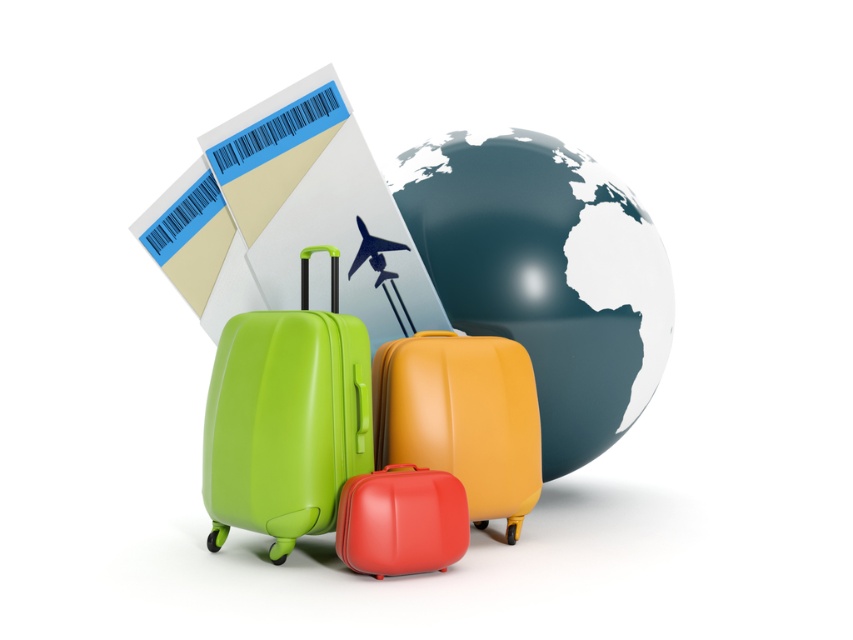
Question: Among these points, which one is nearest to the camera?

Choices:
 (A) (550, 234)
 (B) (408, 572)

Answer: (B)

Question: In this image, where is green matte suitcase at center located relative to matte red suitcase at center?

Choices:
 (A) left
 (B) right

Answer: (A)

Question: Does shiny metallic globe at center come behind green matte suitcase at center?

Choices:
 (A) yes
 (B) no

Answer: (A)

Question: Among these points, which one is farthest from the camera?

Choices:
 (A) (622, 422)
 (B) (424, 348)

Answer: (A)

Question: Which point appears farthest from the camera in this image?

Choices:
 (A) (556, 145)
 (B) (245, 324)
 (C) (413, 470)

Answer: (A)

Question: Is shiny metallic globe at center bigger than matte orange suitcase at center?

Choices:
 (A) no
 (B) yes

Answer: (B)